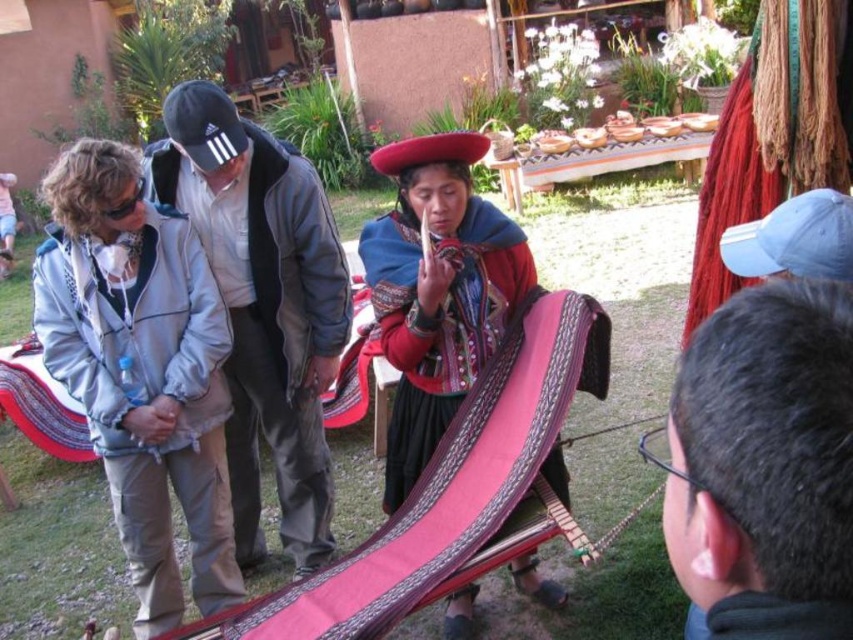
Based on the photo, you are a visitor at a cultural fair and want to take a photo of both the gray fabric at left and the matte red fabric at center. The camera you have can only focus on objects within a 30 inch range. Will you be able to capture both fabrics in one shot?

The gray fabric at left and matte red fabric at center are 33.10 inches apart, which exceeds the camera focus range of 30 inches. Therefore, you cannot capture both fabrics in one shot.

In the scene shown: You are an anthropologist observing the scene. You notice the gray fabric at left and the matte red fabric at center. Which fabric is located below the other?

The gray fabric at left is positioned under the matte red fabric at center, so the gray fabric is below the red one.

You are a photographer standing in the courtyard and want to take a photo of both the dark gray hair at upper right and the matte red fabric at center. Which object should you focus on first to ensure both are in sharp focus?

You should focus on the dark gray hair at upper right first because it is closer to you than the matte red fabric at center, ensuring both will be in focus when using a shallow depth of field.